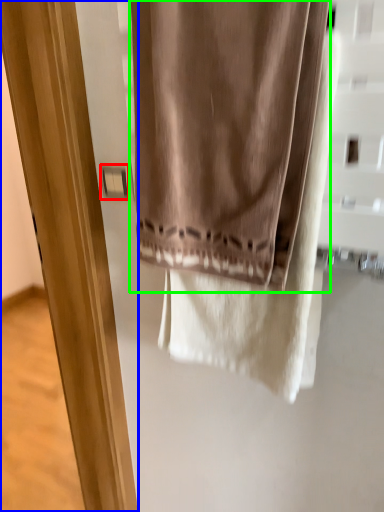
Question: Which object is the closest to the light switch (highlighted by a red box)? Choose among these: screen door (highlighted by a blue box) or curtain (highlighted by a green box).

Choices:
 (A) screen door
 (B) curtain

Answer: (B)